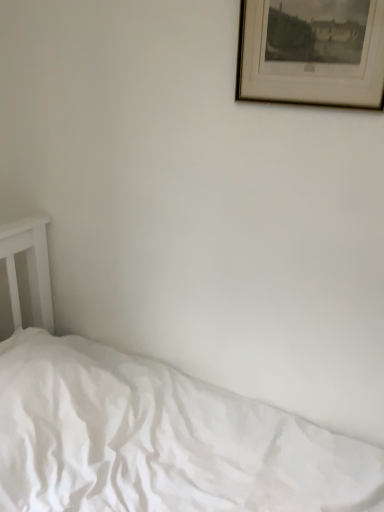
Question: Considering the positions of point (246, 31) and point (158, 484), is point (246, 31) closer or farther from the camera than point (158, 484)?

Choices:
 (A) farther
 (B) closer

Answer: (B)

Question: From the image's perspective, is wooden picture frame at upper right positioned above or below white cotton bed at lower left?

Choices:
 (A) below
 (B) above

Answer: (B)

Question: Considering the relative positions of wooden picture frame at upper right and white cotton bed at lower left in the image provided, is wooden picture frame at upper right to the left or to the right of white cotton bed at lower left?

Choices:
 (A) right
 (B) left

Answer: (A)

Question: Relative to wooden picture frame at upper right, is white cotton bed at lower left in front or behind?

Choices:
 (A) front
 (B) behind

Answer: (A)

Question: Is white cotton bed at lower left taller or shorter than wooden picture frame at upper right?

Choices:
 (A) short
 (B) tall

Answer: (B)

Question: Is point (258, 464) positioned closer to the camera than point (256, 57)?

Choices:
 (A) closer
 (B) farther

Answer: (B)

Question: In the image, is white cotton bed at lower left on the left side or the right side of wooden picture frame at upper right?

Choices:
 (A) left
 (B) right

Answer: (A)